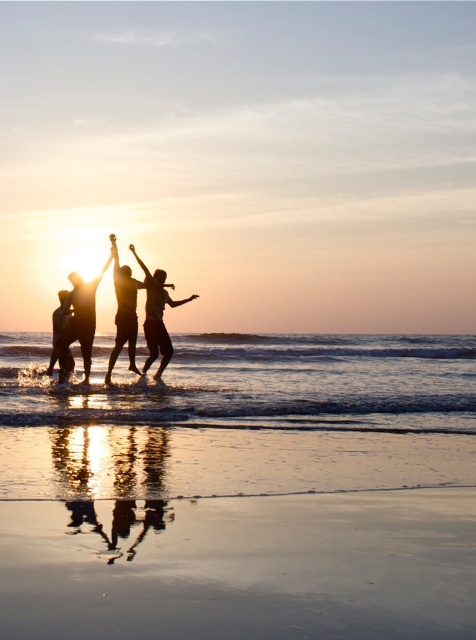
You are a photographer trying to capture the sunset scene. You want to ensure that the shiny sand beach at lower center and the silhouette figure at lower left are both visible in your shot. Based on their widths, which object should you position closer to the center of the frame to ensure it takes up more space?

The shiny sand beach at lower center should be positioned closer to the center of the frame because its width surpasses that of the silhouette figure at lower left, allowing it to occupy more space in the photo.